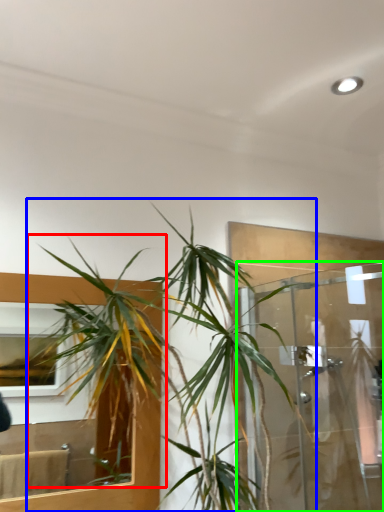
Question: Estimate the real-world distances between objects in this image. Which object is closer to vegetation (highlighted by a red box), houseplant (highlighted by a blue box) or glass door (highlighted by a green box)?

Choices:
 (A) houseplant
 (B) glass door

Answer: (A)